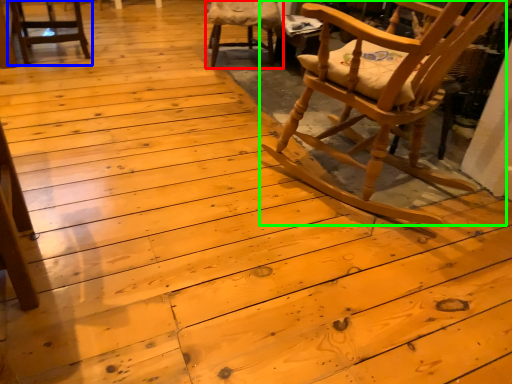
Question: Estimate the real-world distances between objects in this image. Which object is farther from chair (highlighted by a red box), chair (highlighted by a blue box) or chair (highlighted by a green box)?

Choices:
 (A) chair
 (B) chair

Answer: (B)